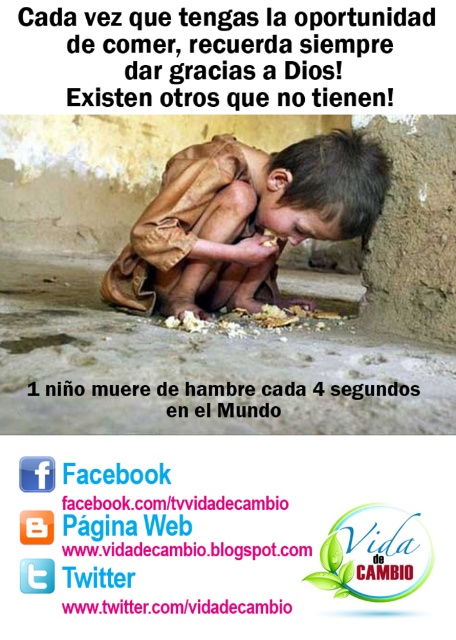
Question: Among these objects, which one is nearest to the camera?

Choices:
 (A) brown rough cloth at center
 (B) white crumbly bread at center

Answer: (B)

Question: Which point is closer to the camera taking this photo?

Choices:
 (A) (321, 316)
 (B) (341, 216)

Answer: (B)

Question: Considering the relative positions of brown rough cloth at center and white crumbly bread at center in the image provided, where is brown rough cloth at center located with respect to white crumbly bread at center?

Choices:
 (A) left
 (B) right

Answer: (A)

Question: Where is brown rough cloth at center located in relation to white crumbly bread at center in the image?

Choices:
 (A) right
 (B) left

Answer: (B)

Question: Does brown rough cloth at center appear on the right side of white crumbly bread at center?

Choices:
 (A) no
 (B) yes

Answer: (A)